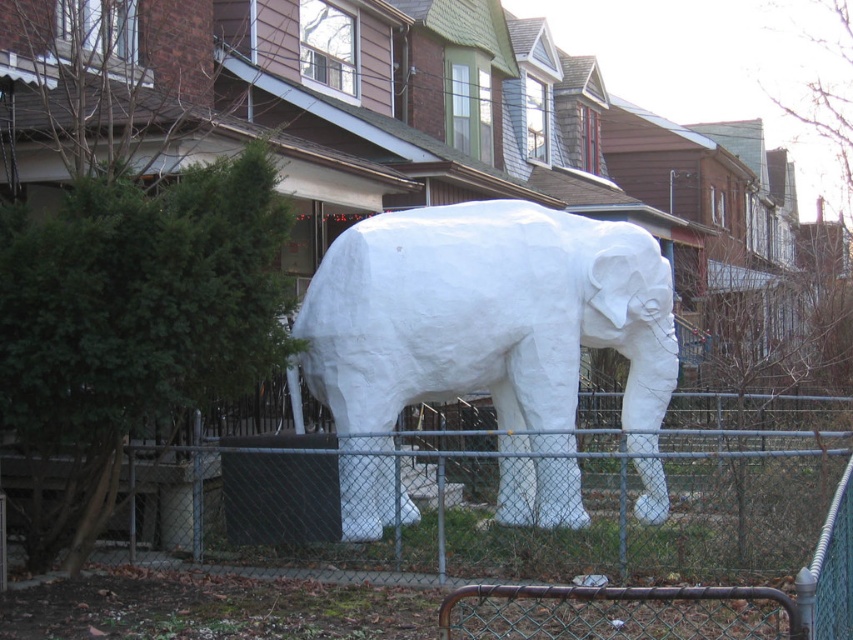
Between metal chain-link fence at center and white paper-like elephant at center, which one has more height?

white paper-like elephant at center is taller.

Is point (746, 461) closer to viewer compared to point (506, 484)?

Yes, it is in front of point (506, 484).

This screenshot has height=640, width=853. What are the coordinates of `metal chain-link fence at center` in the screenshot? It's located at (585, 506).

Find the location of a particular element. The width and height of the screenshot is (853, 640). metal chain-link fence at center is located at coordinates (585, 506).